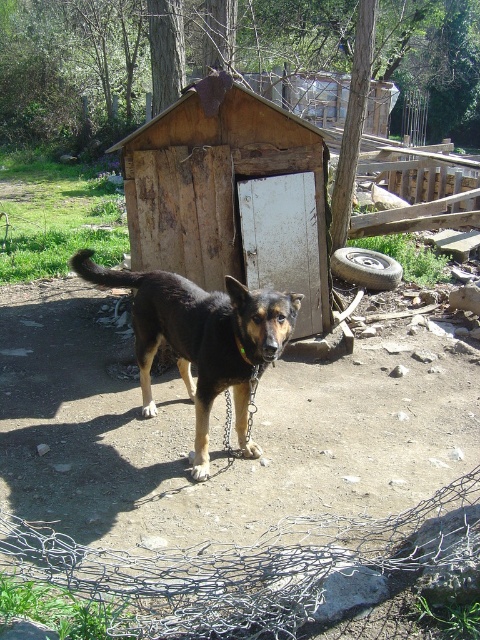
Question: Which point appears farthest from the camera in this image?

Choices:
 (A) (247, 438)
 (B) (242, 150)

Answer: (B)

Question: Which of the following is the closest to the observer?

Choices:
 (A) (159, 273)
 (B) (278, 148)

Answer: (A)

Question: Is weathered wood hut at center below black fur dog at center?

Choices:
 (A) yes
 (B) no

Answer: (B)

Question: Is the position of weathered wood hut at center less distant than that of black fur dog at center?

Choices:
 (A) no
 (B) yes

Answer: (A)

Question: Among these objects, which one is nearest to the camera?

Choices:
 (A) weathered wood hut at center
 (B) black fur dog at center

Answer: (B)

Question: In this image, where is weathered wood hut at center located relative to black fur dog at center?

Choices:
 (A) left
 (B) right

Answer: (B)